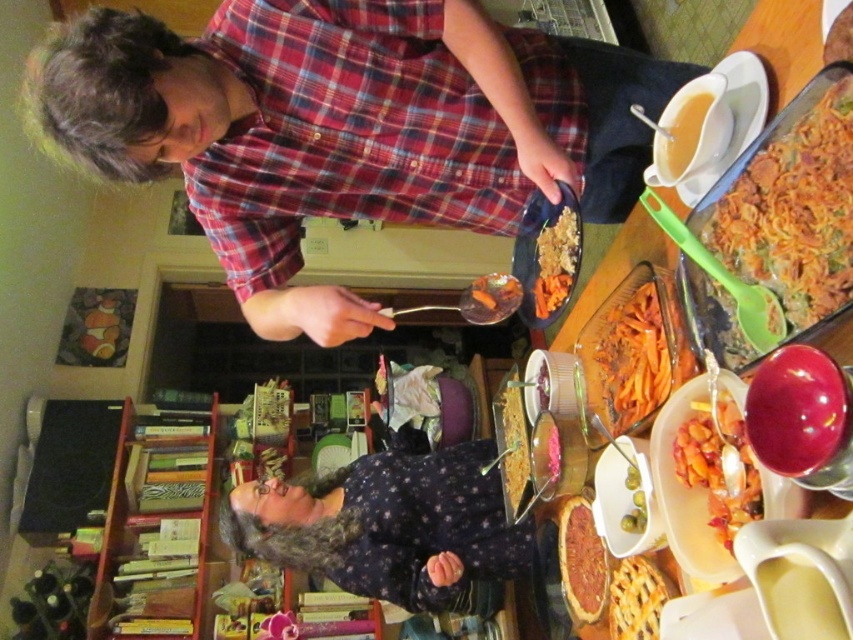
You are a guest at the dinner table and want to serve yourself. The shiny orange pasta at center and the yellow creamy gravy at upper right are both on the table. Which dish do you think you can take a larger portion from based on their sizes?

The shiny orange pasta at center has a larger width than the yellow creamy gravy at upper right, so you can take a larger portion from the shiny orange pasta at center.

You are a guest at the dinner table and want to choose between the carrot salad at center and the yellow creamy gravy at upper right. Which one is taller?

The yellow creamy gravy at upper right is taller than the carrot salad at center.